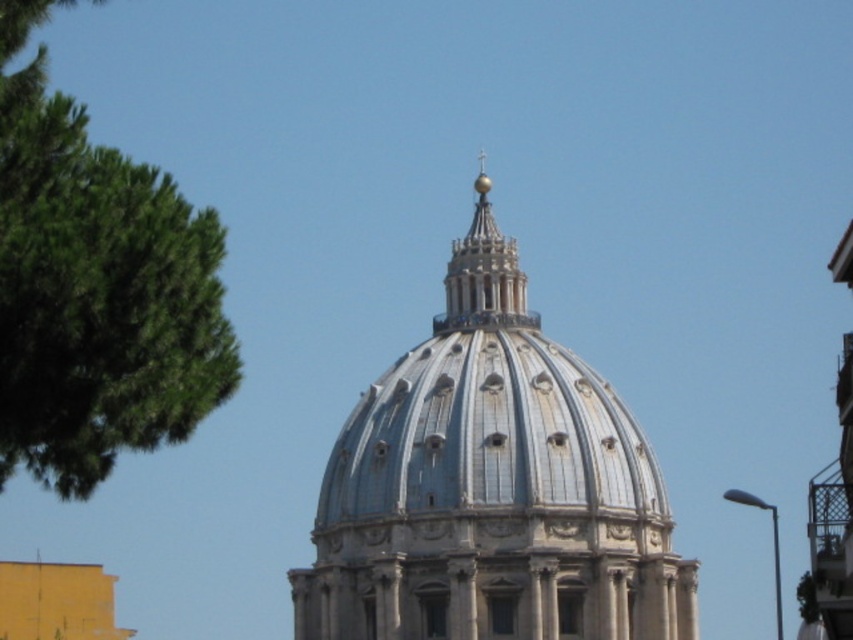
Between point (515, 493) and point (492, 272), which one is positioned behind?

The point (492, 272) is more distant.

Does white stone dome at center have a lesser width compared to gold polished dome at upper center?

No.

Identify the location of white stone dome at center. The width and height of the screenshot is (853, 640). (491, 486).

Does green leafy tree at left lie behind gold polished dome at upper center?

That is False.

Is green leafy tree at left in front of gold polished dome at upper center?

Yes, green leafy tree at left is in front of gold polished dome at upper center.

Describe the element at coordinates (96, 289) in the screenshot. I see `green leafy tree at left` at that location.

Find the location of `green leafy tree at left`. green leafy tree at left is located at coordinates (96, 289).

Who is more distant from viewer, [657,605] or [53,344]?

Positioned behind is point [657,605].

Between white stone dome at center and green leafy tree at left, which one has less height?

With less height is green leafy tree at left.

Between point (357, 468) and point (41, 461), which one is positioned in front?

Point (41, 461)

Where is `white stone dome at center`? The width and height of the screenshot is (853, 640). white stone dome at center is located at coordinates (491, 486).